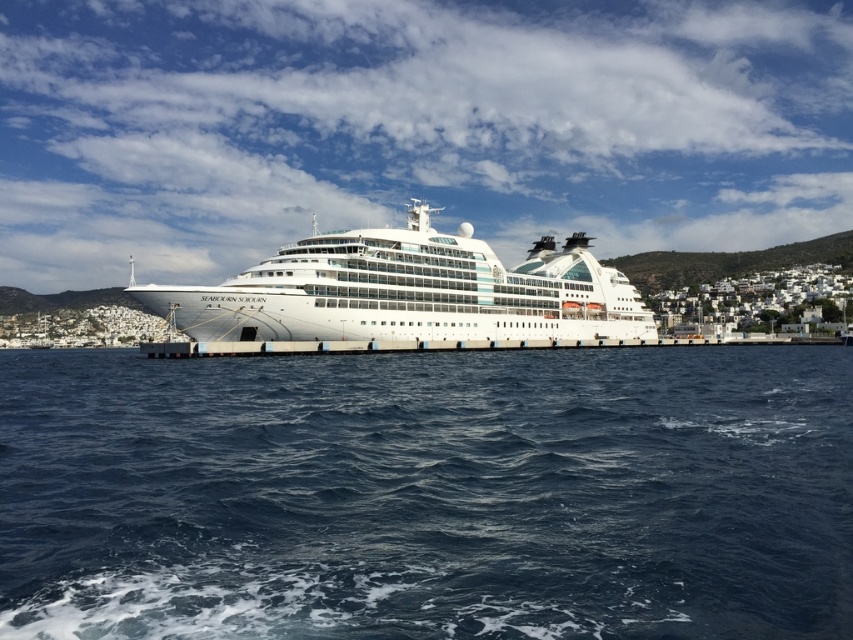
Can you confirm if dark blue water at center is shorter than white glossy cruise ship at center?

Indeed, dark blue water at center has a lesser height compared to white glossy cruise ship at center.

Which of these two, dark blue water at center or white glossy cruise ship at center, stands shorter?

dark blue water at center is shorter.

Who is more distant from viewer, (743, 625) or (624, 314)?

Point (624, 314)

Where is `dark blue water at center`? Image resolution: width=853 pixels, height=640 pixels. dark blue water at center is located at coordinates (427, 493).